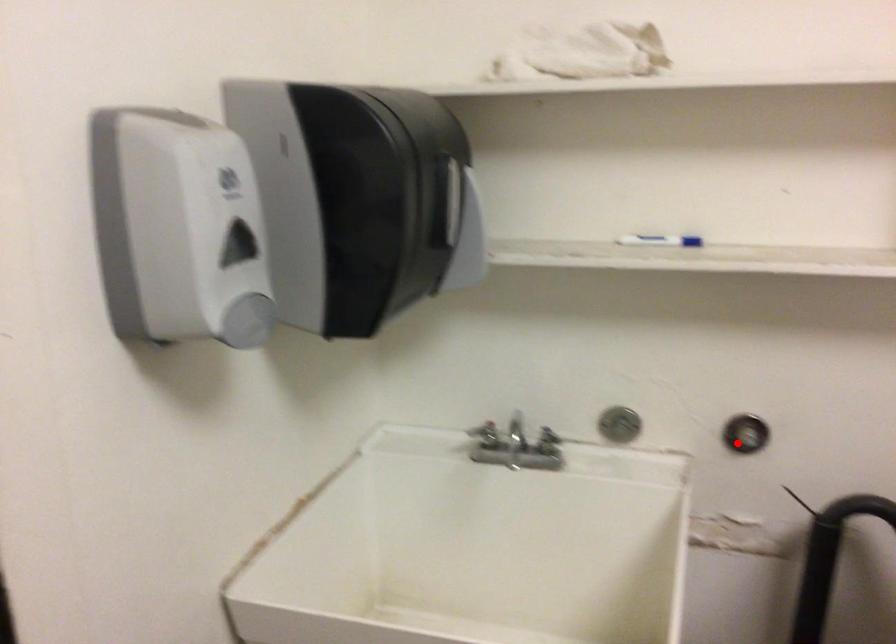
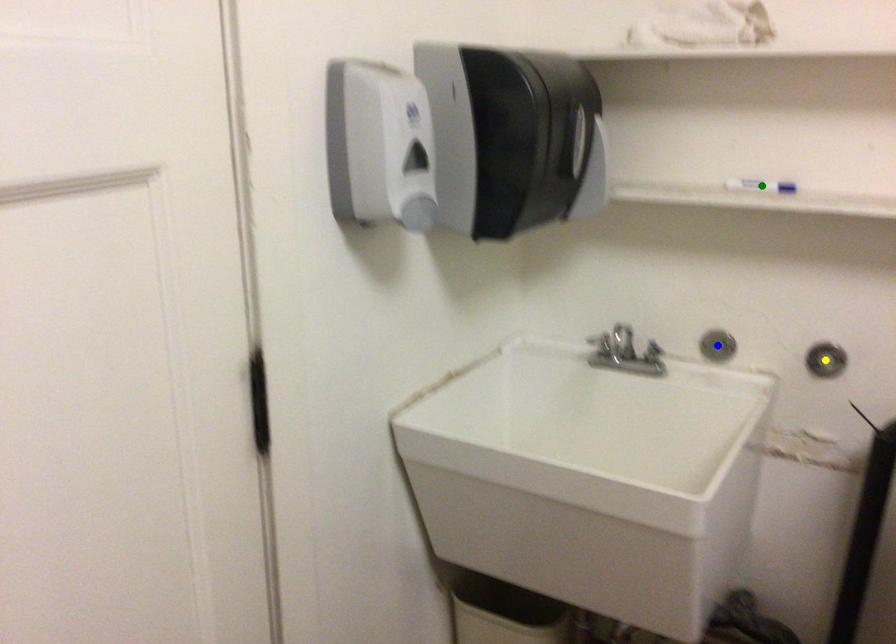
Question: I am providing you with two images of the same scene from different viewpoints. A red point is marked on the first image. You are given multiple points on the second image. Which point in image 2 represents the same 3d spot as the red point in image 1?

Choices:
 (A) blue point
 (B) green point
 (C) yellow point

Answer: (C)